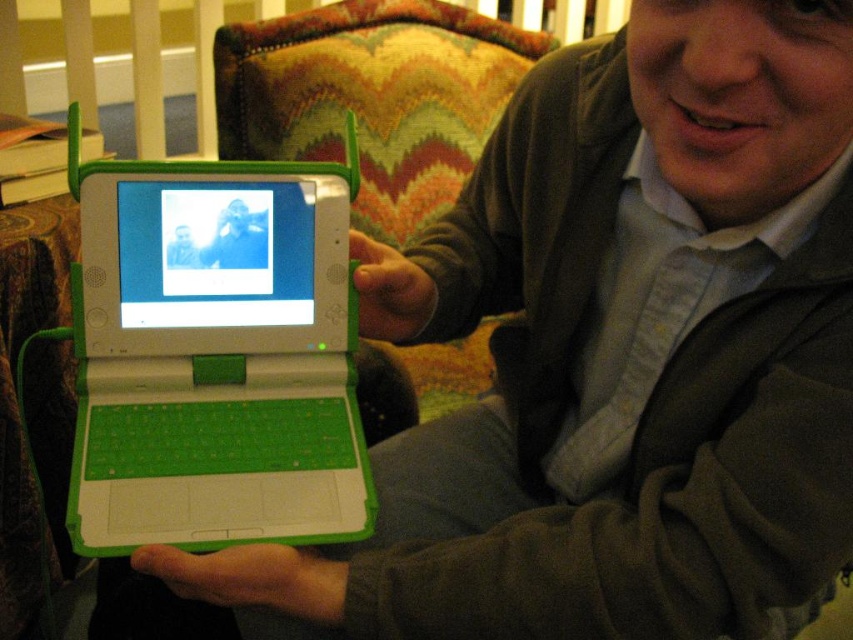
You are a photographer who needs to take a clear photo of the camera using the green plastic laptop at center. The camera must be in focus, and the distance between the camera and the laptop should be exactly 60 centimeters. Is the current distance sufficient for your requirements?

The green plastic laptop at center and camera are 58.56 centimeters apart, which is slightly less than the required 60 centimeters. Therefore, the current distance is insufficient to meet the exact requirement of 60 centimeters for taking the photo.

You are trying to decide which laptop to take with you for a trip. You have both the green plastic laptop at center and the matte green laptop at center available. Based on their sizes, which one would you choose if you prefer a smaller device?

The matte green laptop at center is smaller in size than the green plastic laptop at center, so you should choose the matte green laptop at center if you prefer a smaller device.